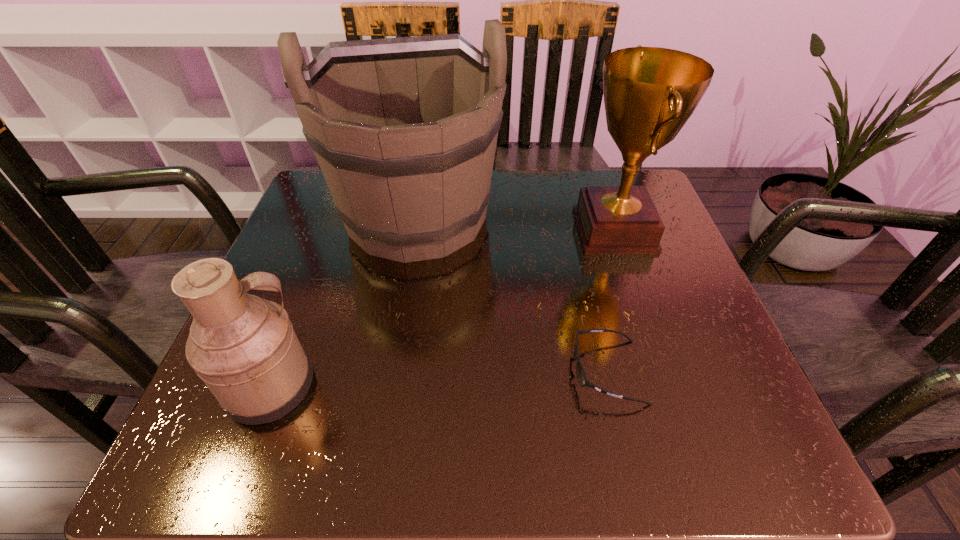
Where is `empty space that is in between the award and the shortest object`? This screenshot has width=960, height=540. empty space that is in between the award and the shortest object is located at coordinates (611, 301).

The height and width of the screenshot is (540, 960). Find the location of `free space between the award and the bucket`. free space between the award and the bucket is located at coordinates (516, 223).

Image resolution: width=960 pixels, height=540 pixels. In order to click on free space between the award and the bucket in this screenshot , I will do `click(516, 223)`.

In order to click on vacant point located between the third tallest object and the bucket in this screenshot , I will do `click(344, 301)`.

Identify the location of free space between the award and the sunglasses. click(611, 301).

Find the location of `free point between the award and the second shortest object`. free point between the award and the second shortest object is located at coordinates (443, 308).

Find the location of `free point between the award and the sunglasses`. free point between the award and the sunglasses is located at coordinates (611, 301).

At what (x,y) coordinates should I click in order to perform the action: click on object that ranks as the third closest to the shortest object. Please return your answer as a coordinate pair (x, y). This screenshot has width=960, height=540. Looking at the image, I should click on (244, 348).

What are the coordinates of `object that can be found as the third closest to the award` in the screenshot? It's located at (244, 348).

This screenshot has width=960, height=540. What are the coordinates of `vacant area in the image that satisfies the following two spatial constraints: 1. on the plaque of the award; 2. on the front side of the pitcher` in the screenshot? It's located at (667, 386).